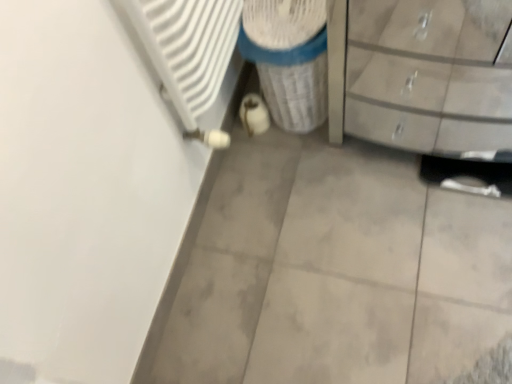
Question: In terms of size, does matte gray chest of drawers at right appear bigger or smaller than white textured cylinder at center?

Choices:
 (A) big
 (B) small

Answer: (A)

Question: From a real-world perspective, is matte gray chest of drawers at right physically located above or below white textured cylinder at center?

Choices:
 (A) below
 (B) above

Answer: (B)

Question: Is point (408, 41) positioned closer to the camera than point (305, 102)?

Choices:
 (A) closer
 (B) farther

Answer: (B)

Question: From the image's perspective, is white textured cylinder at center located above or below matte gray chest of drawers at right?

Choices:
 (A) above
 (B) below

Answer: (A)

Question: Is white textured cylinder at center situated inside matte gray chest of drawers at right or outside?

Choices:
 (A) outside
 (B) inside

Answer: (A)

Question: Considering the positions of point (301, 82) and point (373, 139), is point (301, 82) closer or farther from the camera than point (373, 139)?

Choices:
 (A) farther
 (B) closer

Answer: (B)

Question: Would you say white textured cylinder at center is to the left or to the right of matte gray chest of drawers at right in the picture?

Choices:
 (A) left
 (B) right

Answer: (A)